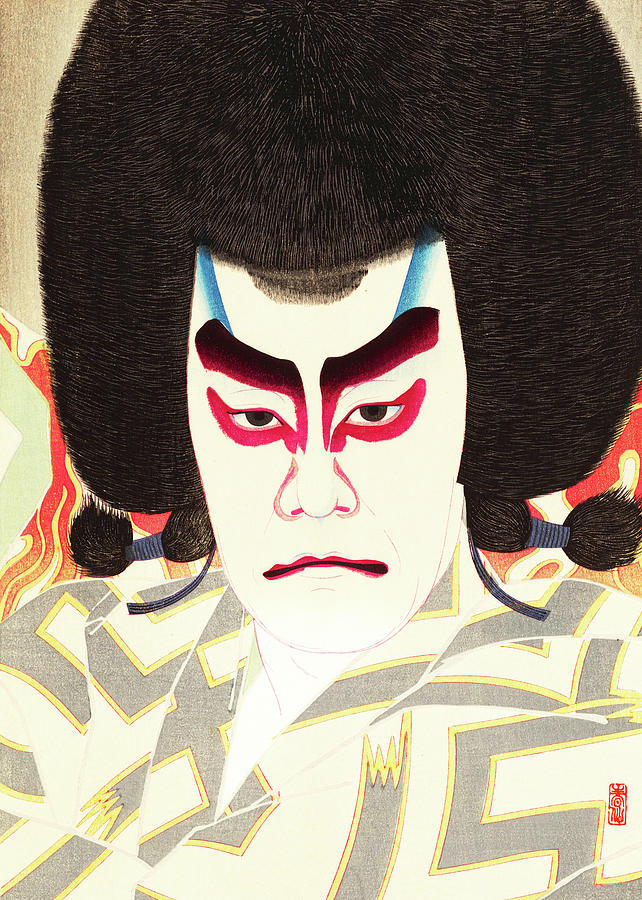
I want to click on art, so click(469, 664).